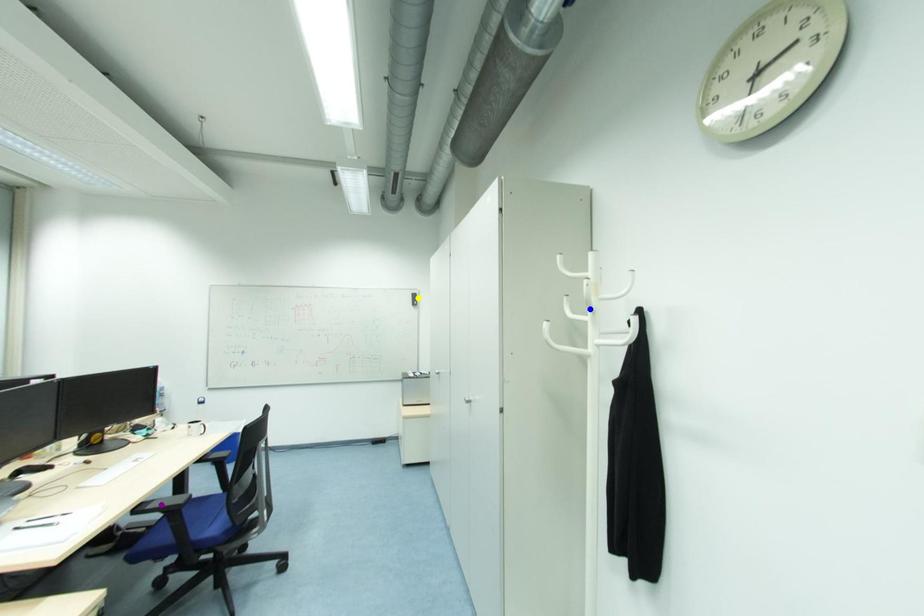
Based on the photo, order these from farthest to nearest:
purple point, yellow point, blue point

1. yellow point
2. purple point
3. blue point